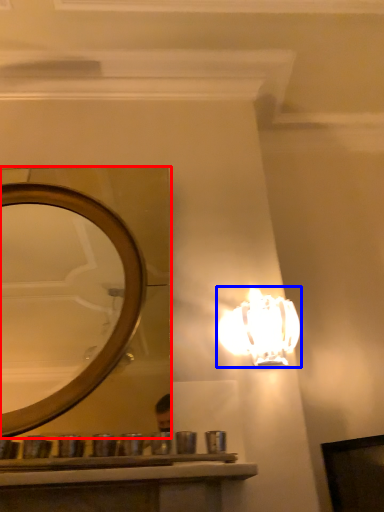
Question: Which of the following is the closest to the observer, mirror (highlighted by a red box) or lamp (highlighted by a blue box)?

Choices:
 (A) mirror
 (B) lamp

Answer: (A)